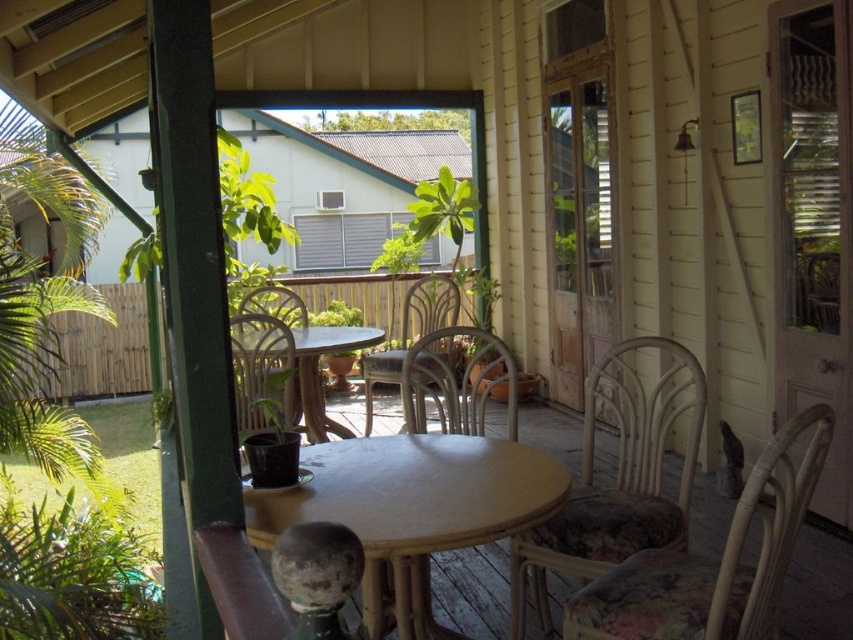
You are planning to set up a small garden in the lower right corner of the patio. There is a woven rattan chair at lower right and a metallic silver chair at center. Which chair should you move to make space for the garden?

You should move the woven rattan chair at lower right because it is located below the metallic silver chair at center, making it closer to the lower right corner where you want to set up the garden.

You are planning to place a rectangular table that is 1.2 meters wide between the woven rattan chair at lower right and the metallic silver chair at center. Based on the space available between them, will the table fit comfortably?

The woven rattan chair at lower right has a lesser width compared to metallic silver chair at center. Since the table is 1.2 meters wide, and the space between the chairs is determined by their widths, the table may not fit comfortably as the distance between them might be insufficient due to the wider metallic silver chair taking up more space.

You are planning to set up a small reading nook on the patio. You have a woven rattan chair at lower right and a matte wicker chair at center. Which chair should you place closer to the ground to ensure it is at the lower elevation?

The woven rattan chair at lower right should be placed closer to the ground since it is already located below the matte wicker chair at center.